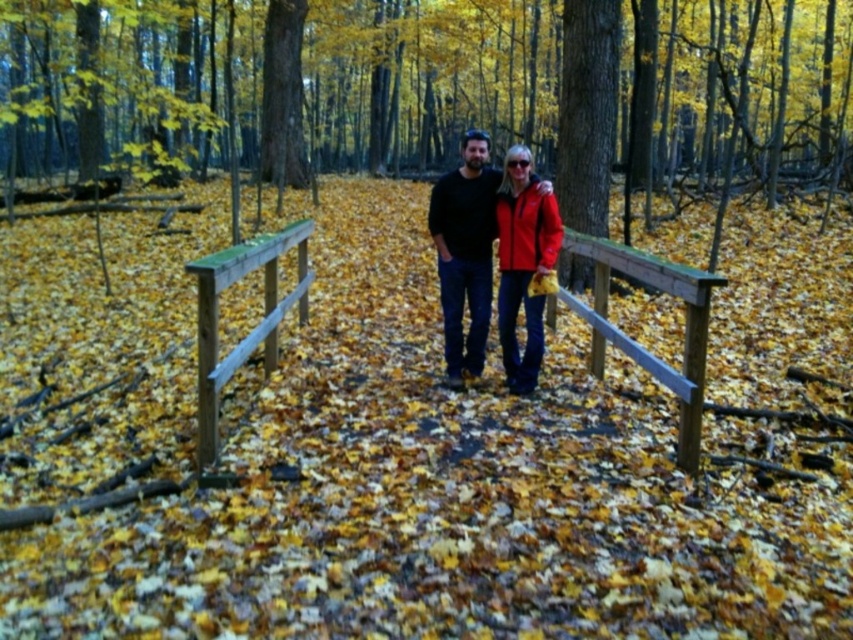
Question: Among these objects, which one is nearest to the camera?

Choices:
 (A) matte black shirt at center
 (B) green wooden rail at center
 (C) matte red jacket at center
 (D) smooth brown bark at upper center

Answer: (B)

Question: Among these points, which one is farthest from the camera?

Choices:
 (A) (560, 170)
 (B) (679, 424)
 (C) (471, 349)
 (D) (271, 298)

Answer: (A)

Question: Can you confirm if matte black shirt at center is positioned to the right of matte red jacket at center?

Choices:
 (A) yes
 (B) no

Answer: (B)

Question: Does smooth brown bark at upper center have a lesser width compared to matte black shirt at center?

Choices:
 (A) yes
 (B) no

Answer: (B)

Question: Among these objects, which one is farthest from the camera?

Choices:
 (A) matte red jacket at center
 (B) wooden rail at center
 (C) matte black shirt at center

Answer: (C)

Question: Is matte black shirt at center thinner than green wooden rail at center?

Choices:
 (A) no
 (B) yes

Answer: (A)